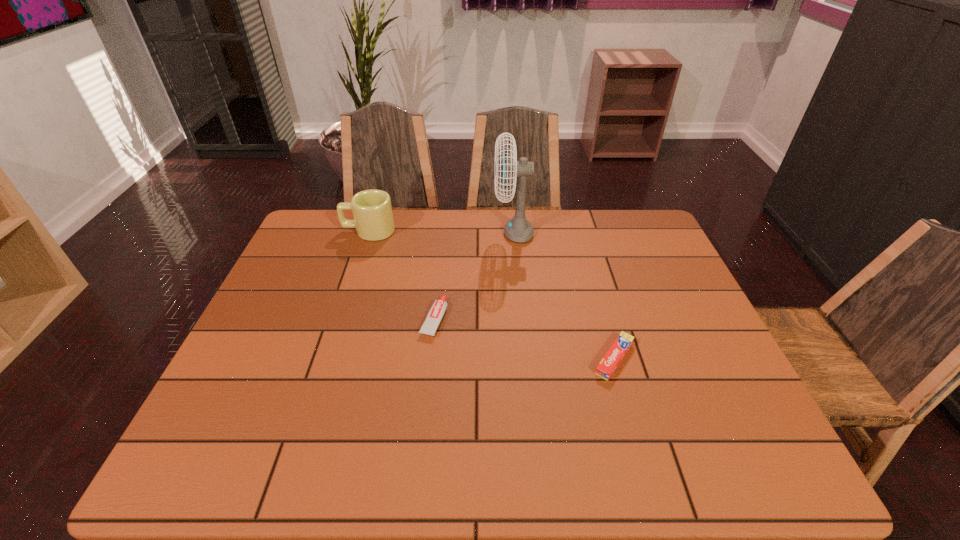
Find the location of a particular element. The image size is (960, 540). the tallest object is located at coordinates (518, 229).

This screenshot has width=960, height=540. In order to click on fan in this screenshot , I will do `click(518, 229)`.

Where is `the second tallest object`? This screenshot has height=540, width=960. the second tallest object is located at coordinates (373, 218).

You are a GUI agent. You are given a task and a screenshot of the screen. Output one action in this format:
    pyautogui.click(x=<x>, y=<y>)
    Task: Click on the mug
    
    Given the screenshot: What is the action you would take?
    pyautogui.click(x=373, y=218)

Locate an element on the screen. the third object from right to left is located at coordinates (429, 327).

This screenshot has height=540, width=960. In order to click on the rightmost object in this screenshot , I will do `click(615, 354)`.

This screenshot has width=960, height=540. I want to click on the shortest object, so click(615, 354).

Locate an element on the screen. The height and width of the screenshot is (540, 960). vacant region located on the front-facing side of the second object from right to left is located at coordinates [382, 232].

You are a GUI agent. You are given a task and a screenshot of the screen. Output one action in this format:
    pyautogui.click(x=<x>, y=<y>)
    Task: Click on the free space located 0.250m on the front-facing side of the second object from right to left
    
    Given the screenshot: What is the action you would take?
    pyautogui.click(x=416, y=232)

Image resolution: width=960 pixels, height=540 pixels. Identify the location of free space located 0.270m on the front-facing side of the second object from right to left. (410, 232).